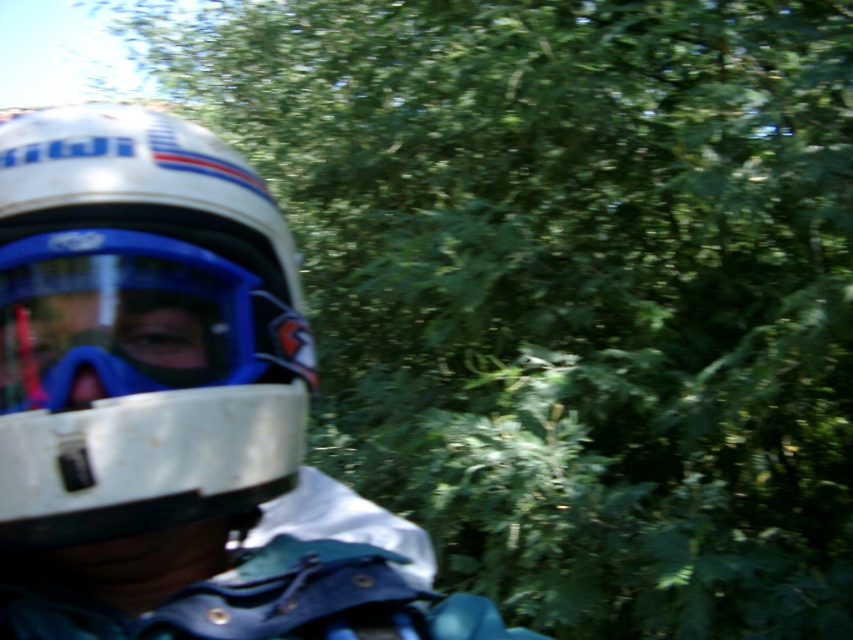
Does white matte helmet at left appear over blue matte/glossy goggles at left?

Correct, white matte helmet at left is located above blue matte/glossy goggles at left.

Which is below, white matte helmet at left or blue matte/glossy goggles at left?

blue matte/glossy goggles at left is below.

Identify the location of white matte helmet at left. Image resolution: width=853 pixels, height=640 pixels. (140, 328).